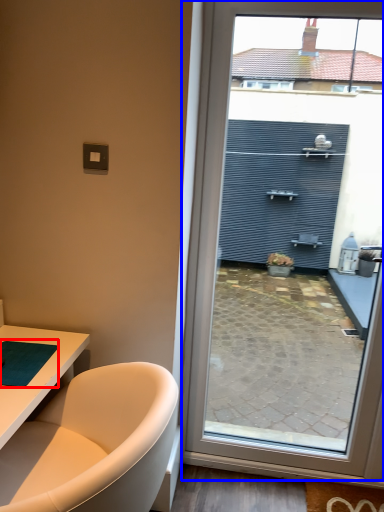
Question: Which of the following is the closest to the observer, yoga mat (highlighted by a red box) or window (highlighted by a blue box)?

Choices:
 (A) yoga mat
 (B) window

Answer: (A)